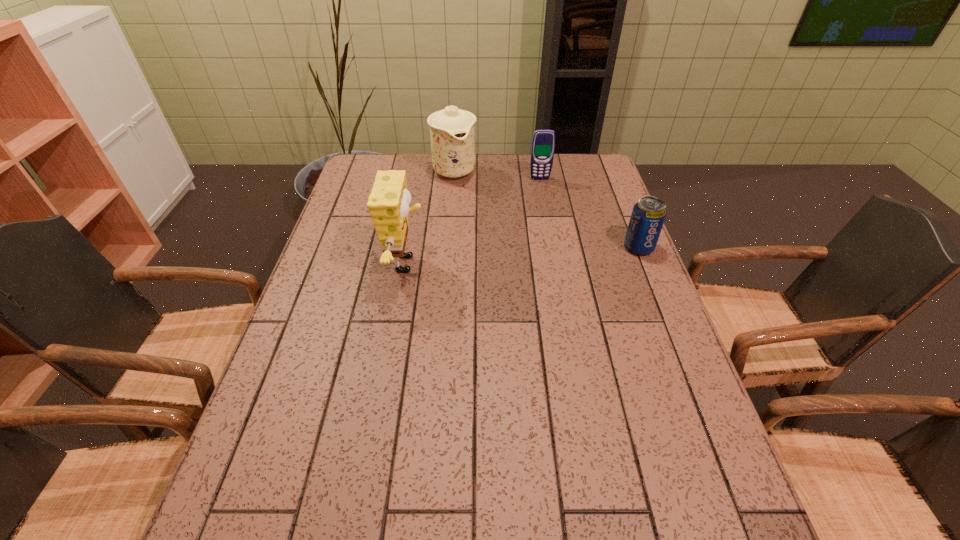
The height and width of the screenshot is (540, 960). Find the location of `sponge`. sponge is located at coordinates (388, 204).

Find the location of a particular element. The image size is (960, 540). the rightmost object is located at coordinates (648, 215).

Locate an element on the screen. The height and width of the screenshot is (540, 960). the shortest object is located at coordinates (648, 215).

The width and height of the screenshot is (960, 540). Find the location of `cellular telephone`. cellular telephone is located at coordinates pyautogui.click(x=543, y=142).

This screenshot has height=540, width=960. Find the location of `chinaware`. chinaware is located at coordinates (452, 131).

Where is `vacant space situated on the front-facing side of the sponge`? Image resolution: width=960 pixels, height=540 pixels. vacant space situated on the front-facing side of the sponge is located at coordinates (456, 264).

The width and height of the screenshot is (960, 540). I want to click on vacant area situated on the back of the rightmost object, so click(x=607, y=168).

The image size is (960, 540). In order to click on vacant region located on the front-facing side of the cellular telephone in this screenshot , I will do `click(547, 218)`.

The width and height of the screenshot is (960, 540). Find the location of `free location located 0.090m on the front-facing side of the cellular telephone`. free location located 0.090m on the front-facing side of the cellular telephone is located at coordinates (542, 194).

Where is `vacant point located on the front-facing side of the cellular telephone`? vacant point located on the front-facing side of the cellular telephone is located at coordinates point(543,201).